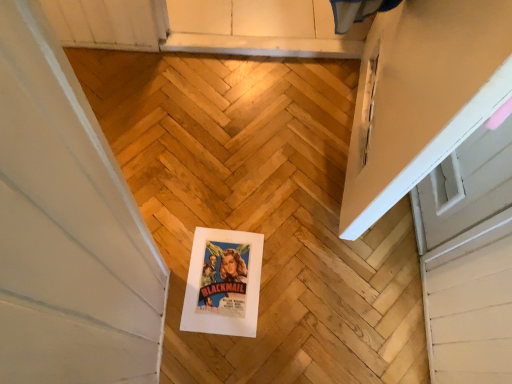
Locate an element on the screen. The height and width of the screenshot is (384, 512). free space above matte paper poster at center (from a real-world perspective) is located at coordinates click(226, 284).